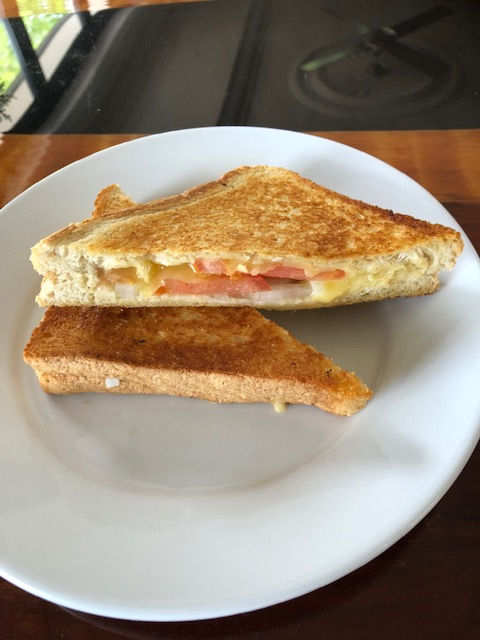
Identify the location of the left hand side of white plate. (2, 322).